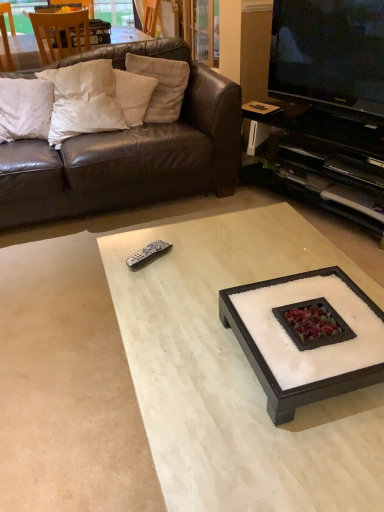
At what (x,y) coordinates should I click in order to perform the action: click on vacant space to the left of white marble coffee table at center, acting as the first coffee table starting from the top. Please return your answer as a coordinate pair (x, y). Looking at the image, I should click on (184, 355).